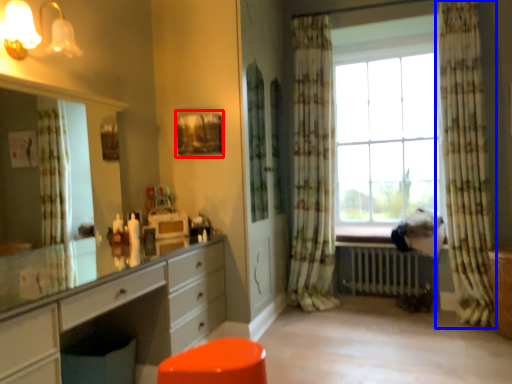
Question: Which object is closer to the camera taking this photo, picture frame (highlighted by a red box) or curtain (highlighted by a blue box)?

Choices:
 (A) picture frame
 (B) curtain

Answer: (A)